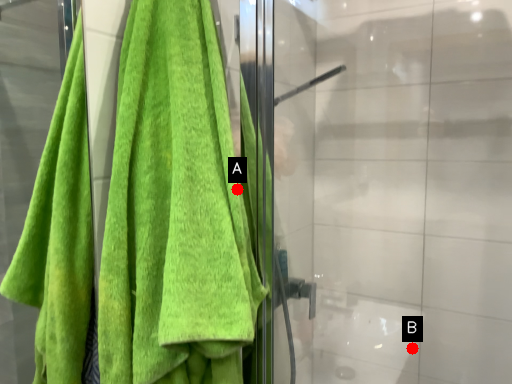
Question: Two points are circled on the image, labeled by A and B beside each circle. Among these points, which one is nearest to the camera?

Choices:
 (A) A is closer
 (B) B is closer

Answer: (A)